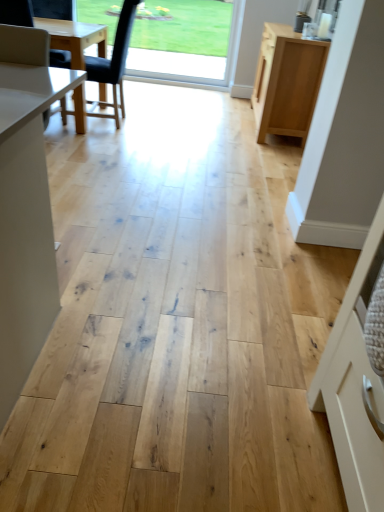
Question: Considering the relative sizes of black leather chair at left and transparent glass window at upper center in the image provided, is black leather chair at left taller than transparent glass window at upper center?

Choices:
 (A) yes
 (B) no

Answer: (A)

Question: Can you confirm if black leather chair at left is positioned to the right of transparent glass window at upper center?

Choices:
 (A) no
 (B) yes

Answer: (A)

Question: From the image's perspective, is black leather chair at left above transparent glass window at upper center?

Choices:
 (A) no
 (B) yes

Answer: (A)

Question: From a real-world perspective, is black leather chair at left on top of transparent glass window at upper center?

Choices:
 (A) yes
 (B) no

Answer: (B)

Question: Considering the relative sizes of black leather chair at left and transparent glass window at upper center in the image provided, is black leather chair at left bigger than transparent glass window at upper center?

Choices:
 (A) yes
 (B) no

Answer: (A)

Question: Are black leather chair at left and transparent glass window at upper center located far from each other?

Choices:
 (A) no
 (B) yes

Answer: (B)

Question: Does black leather chair at left lie behind light wood cabinet at right?

Choices:
 (A) yes
 (B) no

Answer: (B)

Question: Is black leather chair at left bigger than light wood cabinet at right?

Choices:
 (A) no
 (B) yes

Answer: (A)

Question: From the image's perspective, is black leather chair at left on light wood cabinet at right?

Choices:
 (A) yes
 (B) no

Answer: (B)

Question: Would you say black leather chair at left contains light wood cabinet at right?

Choices:
 (A) yes
 (B) no

Answer: (B)

Question: Considering the relative sizes of black leather chair at left and light wood cabinet at right in the image provided, is black leather chair at left wider than light wood cabinet at right?

Choices:
 (A) yes
 (B) no

Answer: (A)

Question: Is black leather chair at left facing away from light wood cabinet at right?

Choices:
 (A) yes
 (B) no

Answer: (A)

Question: From a real-world perspective, is transparent glass window at upper center on top of black leather chair at left?

Choices:
 (A) yes
 (B) no

Answer: (A)